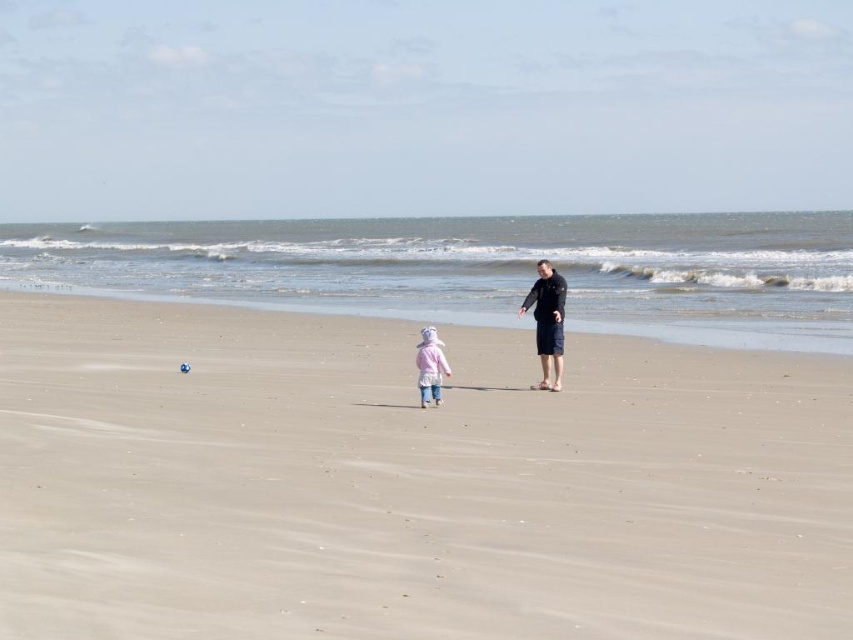
You are a photographer trying to capture the dark blue fabric shorts at center in the beach scene. Based on their position, where should you aim your camera to ensure they are centered in the frame?

To center the dark blue fabric shorts at center in the frame, aim your camera at the coordinates point (x=547, y=321).